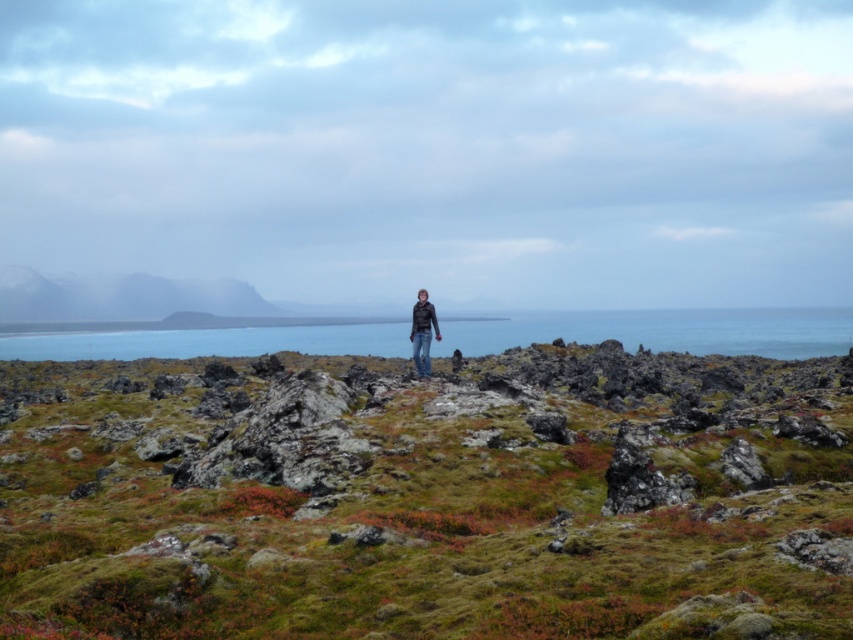
Question: Which object is positioned farthest from the green mossy hillside at center?

Choices:
 (A) matte black jacket at center
 (B) blue water at center

Answer: (B)

Question: Which point is closer to the camera?

Choices:
 (A) blue water at center
 (B) matte black jacket at center
 (C) green mossy hillside at center

Answer: (C)

Question: Can you confirm if green mossy hillside at center is smaller than blue water at center?

Choices:
 (A) no
 (B) yes

Answer: (B)

Question: Does green mossy hillside at center come in front of matte black jacket at center?

Choices:
 (A) yes
 (B) no

Answer: (A)

Question: Can you confirm if green mossy hillside at center is bigger than matte black jacket at center?

Choices:
 (A) no
 (B) yes

Answer: (B)

Question: Among these objects, which one is farthest from the camera?

Choices:
 (A) blue water at center
 (B) matte black jacket at center

Answer: (A)